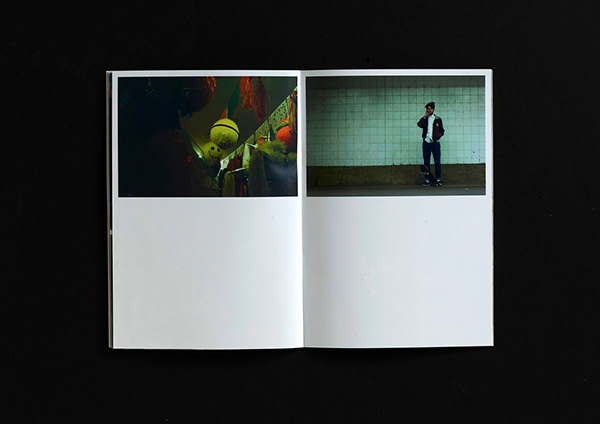
Identify the location of book. This screenshot has height=424, width=600. (232, 295).